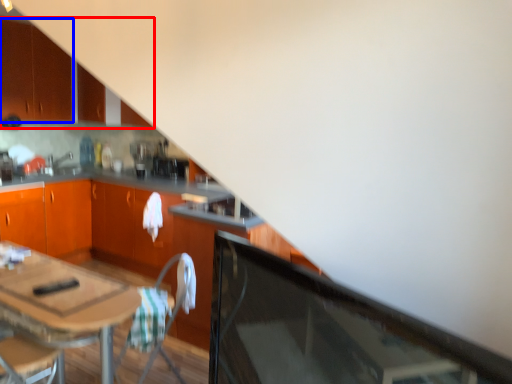
Question: Which object is further to the camera taking this photo, cabinetry (highlighted by a red box) or cabinetry (highlighted by a blue box)?

Choices:
 (A) cabinetry
 (B) cabinetry

Answer: (B)